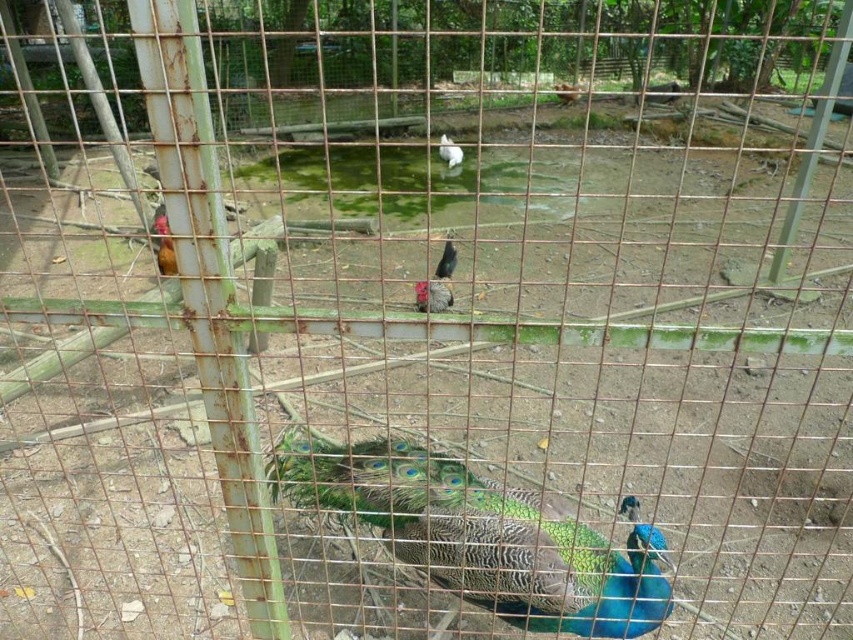
Question: Among these points, which one is nearest to the camera?

Choices:
 (A) (450, 150)
 (B) (437, 298)

Answer: (B)

Question: Which of the following is the farthest from the observer?

Choices:
 (A) (155, 250)
 (B) (334, 492)
 (C) (447, 260)
 (D) (450, 161)

Answer: (D)

Question: Is shiny black rooster at center positioned at the back of white feathered chicken at center?

Choices:
 (A) yes
 (B) no

Answer: (B)

Question: Which point is farther to the camera?

Choices:
 (A) shiny blue peacock at center
 (B) white feathered chicken at center
 (C) shiny black rooster at center

Answer: (B)

Question: Is white feathered chicken at center above smooth brown wooden stick at upper center?

Choices:
 (A) yes
 (B) no

Answer: (B)

Question: Does shiny black rooster at center appear under smooth brown wooden stick at upper center?

Choices:
 (A) no
 (B) yes

Answer: (B)